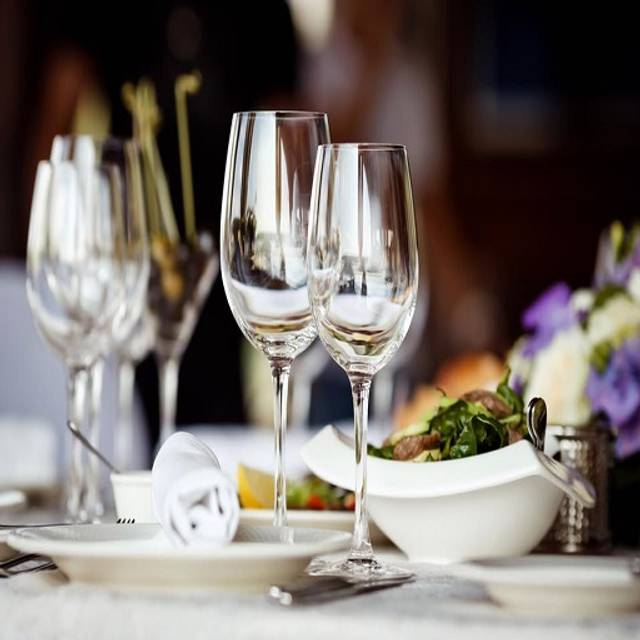
Image resolution: width=640 pixels, height=640 pixels. What are the coordinates of `silverware` in the screenshot? It's located at (179, 506).